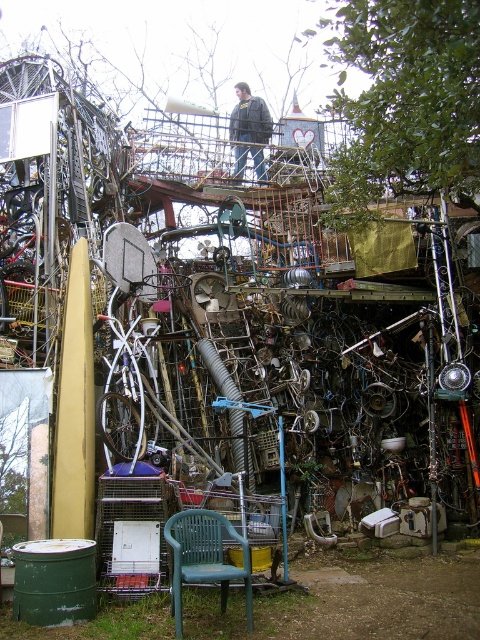
Question: Which of the following is the closest to the observer?

Choices:
 (A) dark gray jacket at upper center
 (B) green plastic chair at lower center

Answer: (B)

Question: Does green plastic chair at lower center appear on the left side of dark gray jacket at upper center?

Choices:
 (A) no
 (B) yes

Answer: (B)

Question: Is green plastic chair at lower center wider than dark gray jacket at upper center?

Choices:
 (A) yes
 (B) no

Answer: (B)

Question: Is green plastic chair at lower center bigger than dark gray jacket at upper center?

Choices:
 (A) yes
 (B) no

Answer: (B)